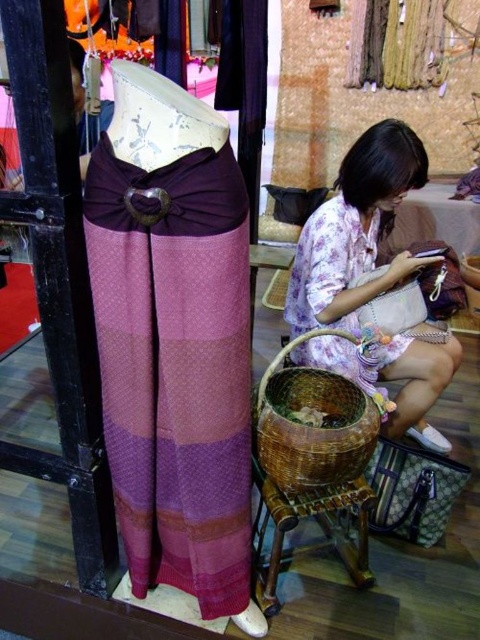
You are a customer in a craft shop and see the textured purple skirt at left and the floral fabric dress at lower right. Which item is located to the left of the other?

The textured purple skirt at left is positioned on the left side of floral fabric dress at lower right.

You are a customer in the shop and want to buy both the floral fabric dress at lower right and the brown woven stool at lower center. However, your shopping bag can only hold one item. Which item should you choose if you want to carry the larger one?

The floral fabric dress at lower right is larger in size than the brown woven stool at lower center, so you should choose the floral fabric dress at lower right to carry the larger item.